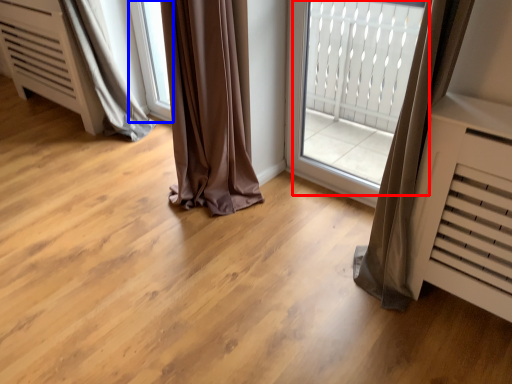
Question: Which object appears farthest to the camera in this image, bay window (highlighted by a red box) or window (highlighted by a blue box)?

Choices:
 (A) bay window
 (B) window

Answer: (B)